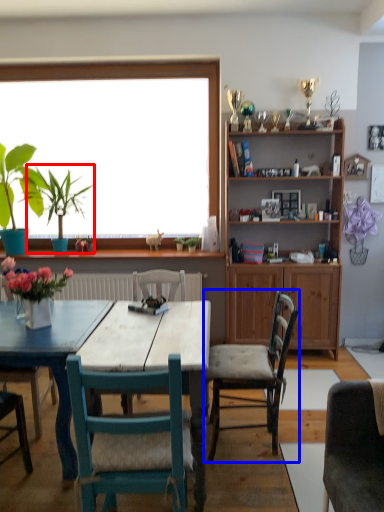
Question: Among these objects, which one is farthest to the camera, plant (highlighted by a red box) or chair (highlighted by a blue box)?

Choices:
 (A) plant
 (B) chair

Answer: (A)